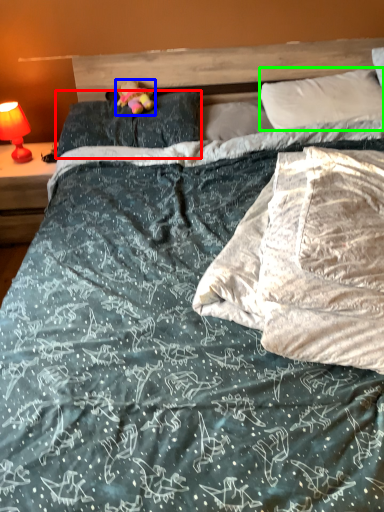
Question: Which object is the closest to the pillow (highlighted by a red box)? Choose among these: figurine (highlighted by a blue box) or pillow (highlighted by a green box).

Choices:
 (A) figurine
 (B) pillow

Answer: (A)